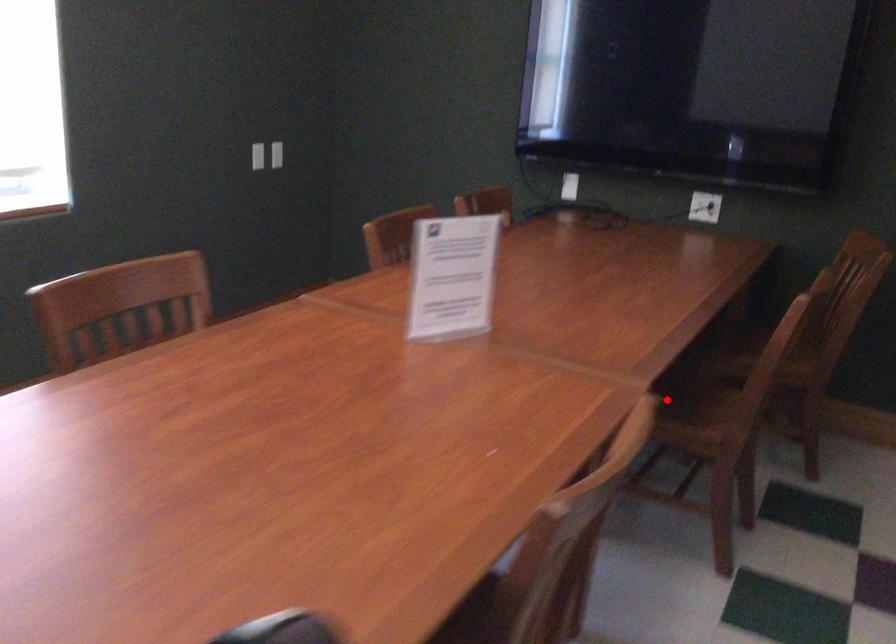
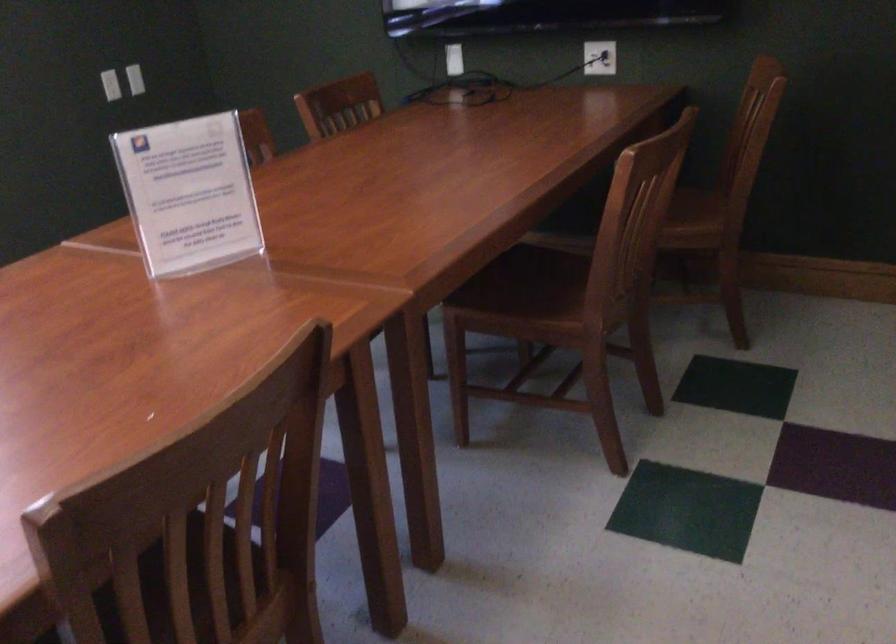
In the second image, find the point that corresponds to the highlighted location in the first image.

(530, 292)